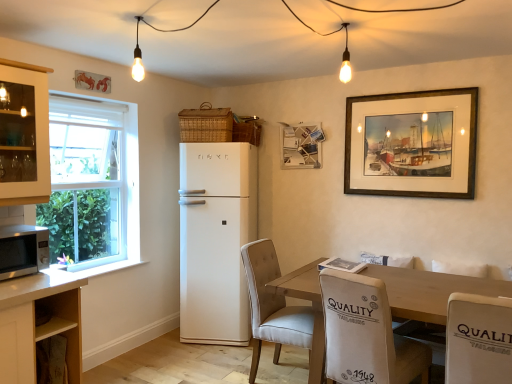
Question: From the image's perspective, does wooden framed painting at upper right, which is the second picture frame in left-to-right order, appear lower than wooden picture frame at upper center, which is the second picture frame from right to left?

Choices:
 (A) yes
 (B) no

Answer: (A)

Question: Does wooden framed painting at upper right, which appears as the first picture frame when viewed from the right, have a greater width compared to wooden picture frame at upper center, placed as the 1th picture frame when sorted from left to right?

Choices:
 (A) yes
 (B) no

Answer: (B)

Question: Does wooden framed painting at upper right, which is the first picture frame in front-to-back order, have a lesser width compared to wooden picture frame at upper center, placed as the 1th picture frame when sorted from left to right?

Choices:
 (A) yes
 (B) no

Answer: (A)

Question: Considering the relative positions of wooden framed painting at upper right, arranged as the second picture frame when viewed from the back, and wooden picture frame at upper center, placed as the 1th picture frame when sorted from left to right, in the image provided, is wooden framed painting at upper right, arranged as the second picture frame when viewed from the back, behind wooden picture frame at upper center, placed as the 1th picture frame when sorted from left to right,?

Choices:
 (A) yes
 (B) no

Answer: (B)

Question: Is wooden framed painting at upper right, which is the first picture frame in front-to-back order, positioned in front of wooden picture frame at upper center, placed as the 1th picture frame when sorted from left to right?

Choices:
 (A) no
 (B) yes

Answer: (B)

Question: Looking at the image, does wooden table at center seem bigger or smaller compared to white fabric chair at lower right, which is counted as the 3th chair, starting from the left?

Choices:
 (A) big
 (B) small

Answer: (A)

Question: Considering the positions of wooden table at center and white fabric chair at lower right, which is counted as the 3th chair, starting from the left, in the image, is wooden table at center taller or shorter than white fabric chair at lower right, which is counted as the 3th chair, starting from the left,?

Choices:
 (A) tall
 (B) short

Answer: (A)

Question: Is wooden table at center wider or thinner than white fabric chair at lower right, the 1th chair positioned from the right?

Choices:
 (A) wide
 (B) thin

Answer: (A)

Question: Relative to white fabric chair at lower right, which is counted as the 3th chair, starting from the left, is wooden table at center in front or behind?

Choices:
 (A) behind
 (B) front

Answer: (A)

Question: From the image's perspective, is white glass cabinet at left, the first cabinetry from the top, above or below white matte refrigerator at center?

Choices:
 (A) below
 (B) above

Answer: (B)

Question: Considering the positions of white glass cabinet at left, the first cabinetry from the top, and white matte refrigerator at center in the image, is white glass cabinet at left, the first cabinetry from the top, taller or shorter than white matte refrigerator at center?

Choices:
 (A) tall
 (B) short

Answer: (B)

Question: In terms of width, does white glass cabinet at left, the first cabinetry from the top, look wider or thinner when compared to white matte refrigerator at center?

Choices:
 (A) thin
 (B) wide

Answer: (A)

Question: Considering the positions of point (32, 97) and point (246, 314), is point (32, 97) closer or farther from the camera than point (246, 314)?

Choices:
 (A) farther
 (B) closer

Answer: (B)

Question: From a real-world perspective, relative to wooden table at center, is beige fabric chair at center, which is the first chair in left-to-right order, vertically above or below?

Choices:
 (A) above
 (B) below

Answer: (A)

Question: Is point (251, 289) positioned closer to the camera than point (436, 288)?

Choices:
 (A) farther
 (B) closer

Answer: (A)